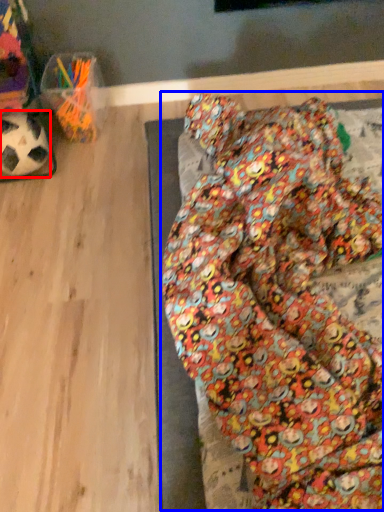
Question: Which point is further to the camera, football (highlighted by a red box) or bean bag chair (highlighted by a blue box)?

Choices:
 (A) football
 (B) bean bag chair

Answer: (A)